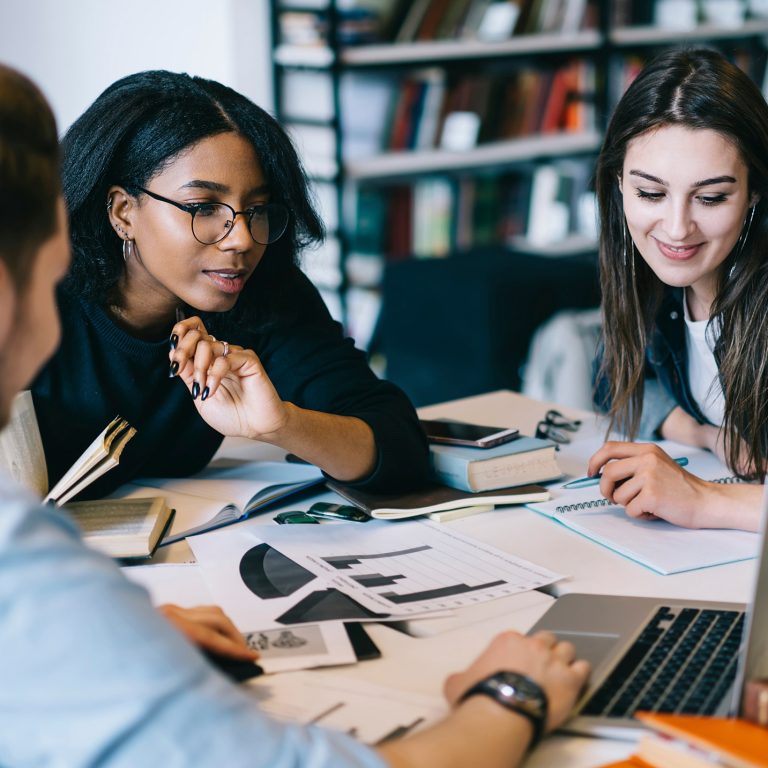
Where is `laptop`? laptop is located at coordinates (608, 616).